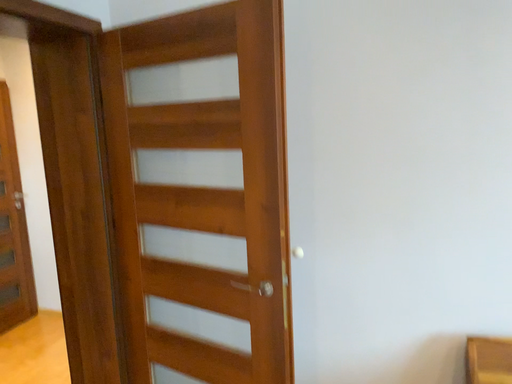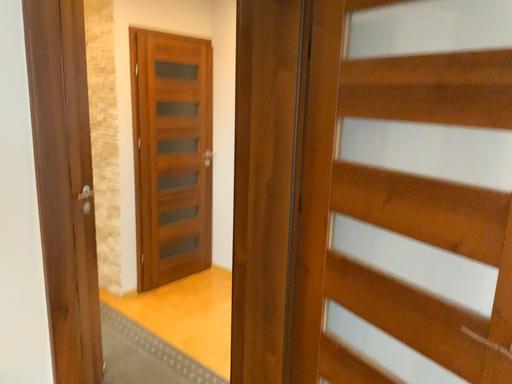
Question: Which way did the camera rotate in the video?

Choices:
 (A) rotated left
 (B) rotated right

Answer: (A)